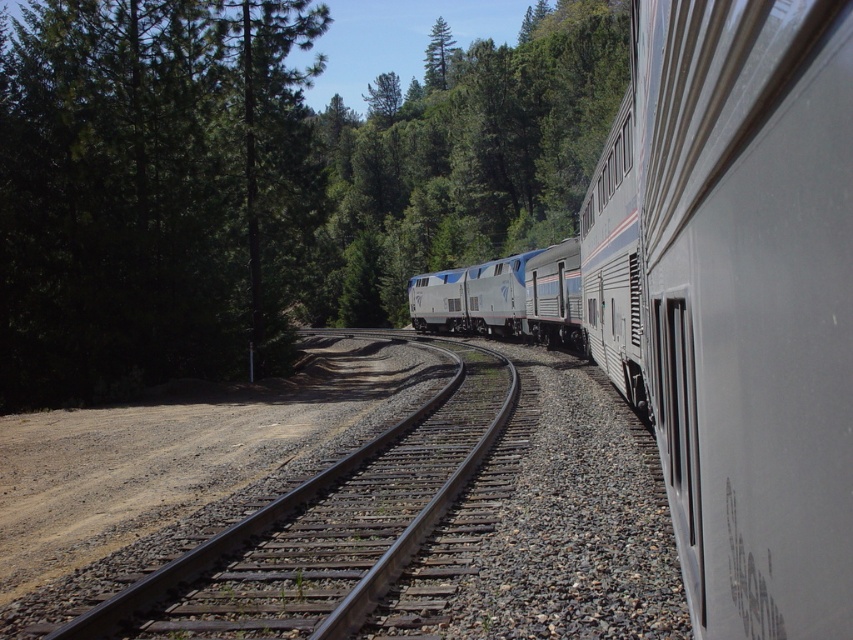
Is green leafy tree at upper left above black metal train track at center?

Indeed, green leafy tree at upper left is positioned over black metal train track at center.

Identify the location of green leafy tree at upper left. (263, 180).

Can you confirm if green leafy tree at upper left is positioned to the left of silver metallic train at center?

Correct, you'll find green leafy tree at upper left to the left of silver metallic train at center.

Is point (84, 310) behind point (679, 387)?

Yes, point (84, 310) is behind point (679, 387).

Describe the element at coordinates (263, 180) in the screenshot. I see `green leafy tree at upper left` at that location.

I want to click on green leafy tree at upper left, so click(x=263, y=180).

Can you confirm if silver metallic train at center is positioned to the right of black metal train track at center?

Correct, you'll find silver metallic train at center to the right of black metal train track at center.

Can you confirm if silver metallic train at center is shorter than black metal train track at center?

No.

Is point (665, 179) positioned after point (299, 600)?

That is False.

You are a GUI agent. You are given a task and a screenshot of the screen. Output one action in this format:
    pyautogui.click(x=<x>, y=<y>)
    Task: Click on the silver metallic train at center
    
    Given the screenshot: What is the action you would take?
    pyautogui.click(x=735, y=298)